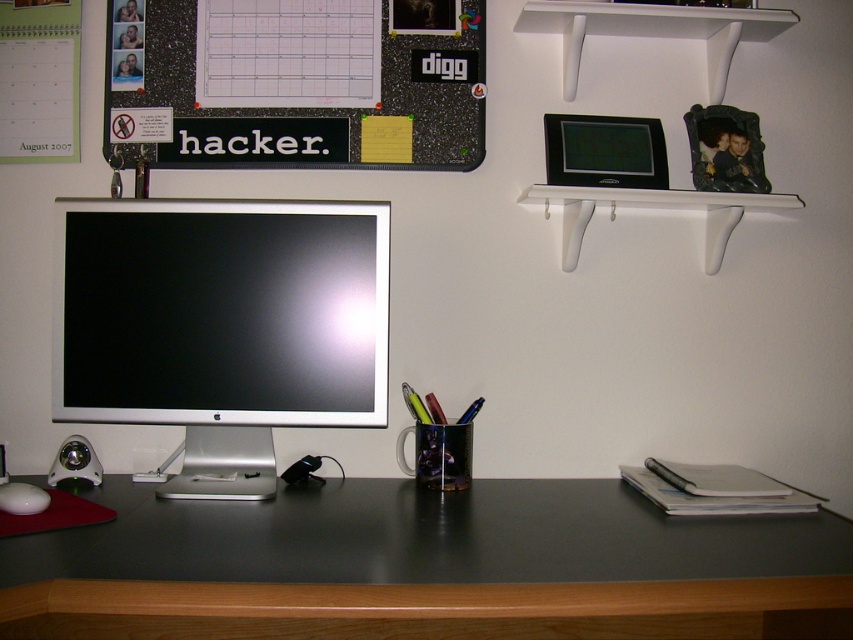
Which is in front, point (247, 36) or point (572, 236)?

Point (572, 236) is in front.

Is point (357, 141) farther from camera compared to point (755, 28)?

Yes, it is behind point (755, 28).

I want to click on black matte signboard at upper center, so [x=294, y=83].

Can you confirm if black matte computer desk at center is taller than sleek silver monitor at center?

No, black matte computer desk at center is not taller than sleek silver monitor at center.

Between point (0, 588) and point (311, 372), which one is positioned in front?

Point (0, 588) is more forward.

This screenshot has height=640, width=853. In order to click on black matte computer desk at center in this screenshot , I will do `click(427, 566)`.

Identify the location of black matte computer desk at center. (427, 566).

Who is lower down, sleek silver monitor at center or white matte mouse at lower left?

white matte mouse at lower left

Is point (271, 272) farther from viewer compared to point (20, 497)?

Yes, it is.

The image size is (853, 640). What do you see at coordinates (221, 324) in the screenshot?
I see `sleek silver monitor at center` at bounding box center [221, 324].

The width and height of the screenshot is (853, 640). Find the location of `sleek silver monitor at center`. sleek silver monitor at center is located at coordinates (221, 324).